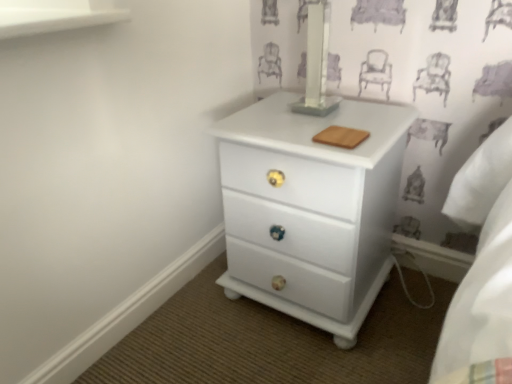
What do you see at coordinates (310, 209) in the screenshot? I see `white painted wood chest of drawers at center` at bounding box center [310, 209].

I want to click on white painted wood chest of drawers at center, so click(310, 209).

Locate an element on the screen. The width and height of the screenshot is (512, 384). white painted wood chest of drawers at center is located at coordinates (310, 209).